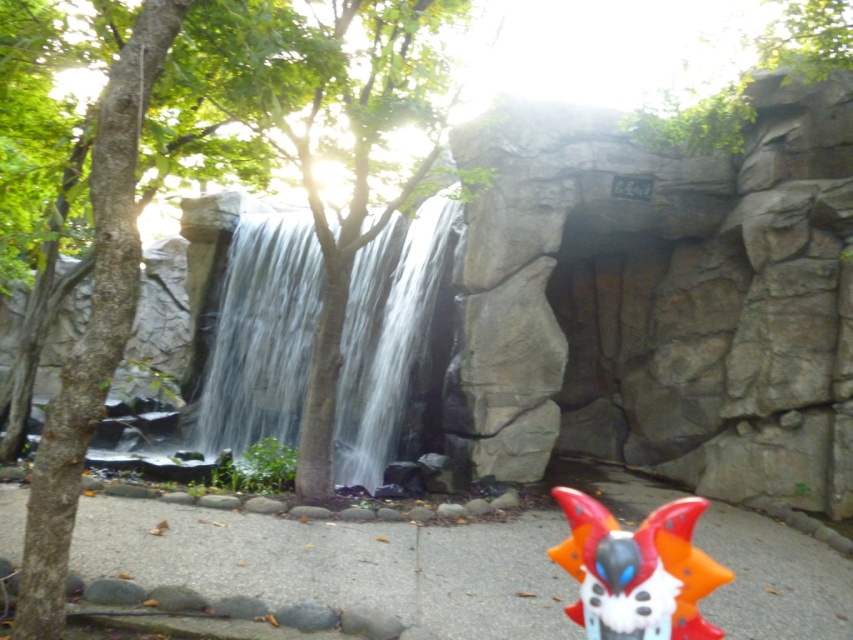
You are a hiker who wants to place a 2 meter long wooden bench between the clear water at center and the orange plastic mask at lower right. Can you fit the bench horizontally between them without moving either object?

The distance between the clear water at center and the orange plastic mask at lower right is 7.34 meters. Since the bench is only 2 meters long, there is sufficient space to place it horizontally between them without moving either object.

Looking at this image, you are standing on the pathway leading to the waterfall and see two points marked in the image. Which point is closer to you, point (254, 317) or point (668, 570)?

Point (254, 317) is closer to you because it is further to the camera than point (668, 570).

You are a hiker who wants to cross the clear water at center near the waterfall. You notice the orange plastic mask at lower right nearby. Which object takes up more space in the image?

The clear water at center takes up more space in the image than the orange plastic mask at lower right because it is larger in size.